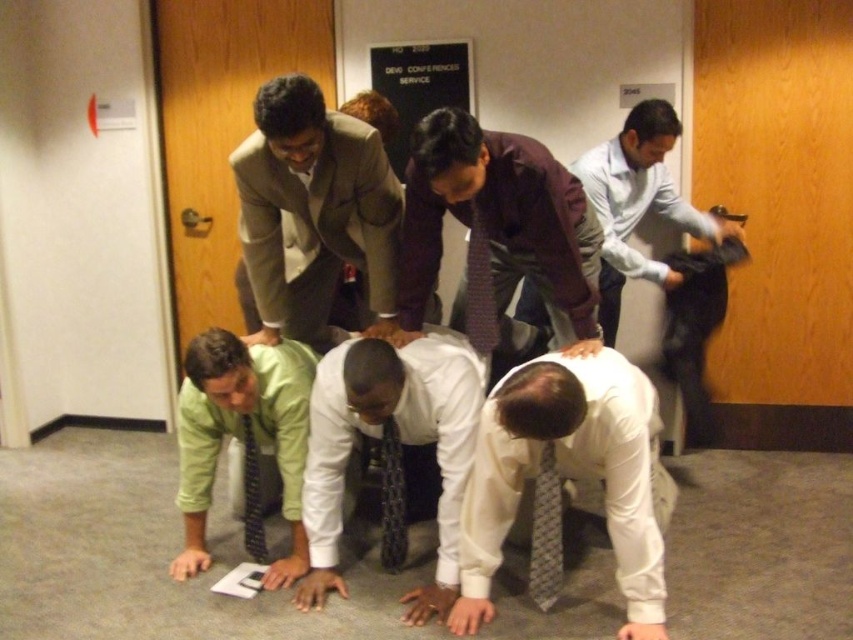
You are standing in the conference room and need to determine which of the two points, point (430, 160) or point (252, 403), is closer to you. Based on the scene description, which point is nearer?

Point (430, 160) is closer to the viewer than point (252, 403).

You are standing in the conference room and notice two items of clothing. The light blue shirt at right and the gray patterned tie at lower center. Which one is positioned more to the right side of the room?

The light blue shirt at right is positioned more to the right side of the room than the gray patterned tie at lower center.

You are standing in the conference room and notice two people in the human chain. One is wearing a maroon textured shirt at center and the other a green matte shirt at lower left. Which of these two shirts is positioned to the right of the other?

The maroon textured shirt at center is positioned on the right side of green matte shirt at lower left.